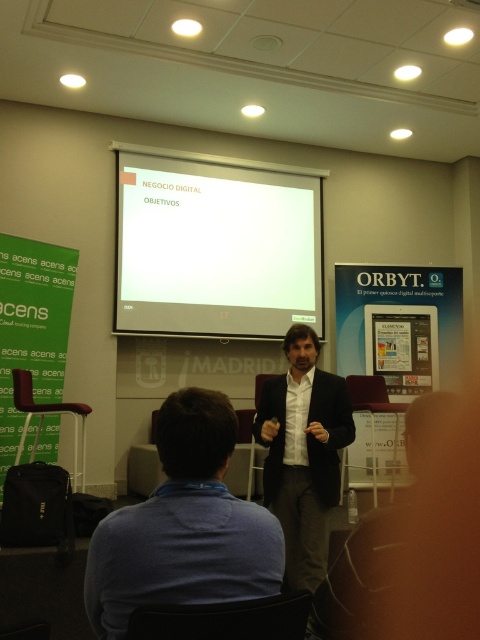
You are an attendee in the conference room and want to take a photo of the presentation. The blue cotton shirt at lower center is blocking your view of the white matte projection screen at center. Can you estimate if the screen is bigger than the shirt in the photo?

The white matte projection screen at center has a larger size compared to the blue cotton shirt at lower center, so yes, the screen is bigger than the shirt in the photo.

Based on the photo, you are an attendee in the conference room. The presenter is standing at the front holding a microphone. Where is the white matte projection screen at center located in terms of coordinates?

The white matte projection screen at center is located at coordinates point (215, 246).

You are an attendee in the conference room and want to take a photo of the presenter. However, you notice that the white matte projection screen at center and the black matte suit at center are blocking your view. Which object is closer to you, making it the primary obstruction?

The white matte projection screen at center is positioned over the black matte suit at center, meaning it is closer to you and thus the primary obstruction.